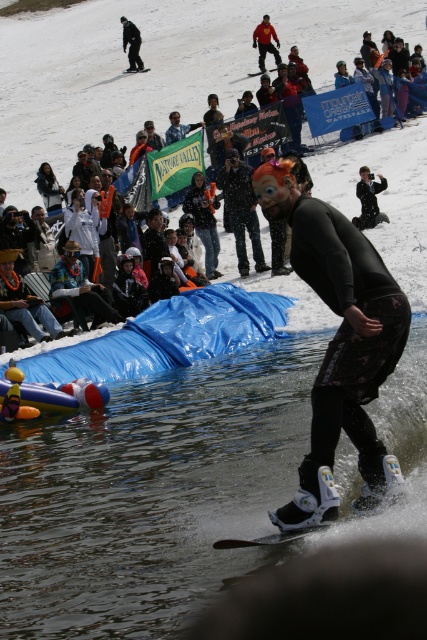
Question: Estimate the real-world distances between objects in this image. Which object is closer to the black matte jacket at center?

Choices:
 (A) orange fabric mask at center
 (B) black matte wetsuit at center

Answer: (A)

Question: Does matte black wetsuit at center appear under orange fabric mask at center?

Choices:
 (A) no
 (B) yes

Answer: (A)

Question: Which of the following is the farthest from the observer?

Choices:
 (A) (225, 404)
 (B) (213, 268)

Answer: (B)

Question: Considering the relative positions of clear plastic water at lower center and orange fabric mask at center in the image provided, where is clear plastic water at lower center located with respect to orange fabric mask at center?

Choices:
 (A) right
 (B) left

Answer: (A)

Question: Does black matte wetsuit at center appear over orange fabric mask at center?

Choices:
 (A) yes
 (B) no

Answer: (B)

Question: Which object is the farthest from the orange fabric mask at center?

Choices:
 (A) clear plastic water at lower center
 (B) matte black wetsuit at center
 (C) black matte jacket at center

Answer: (B)